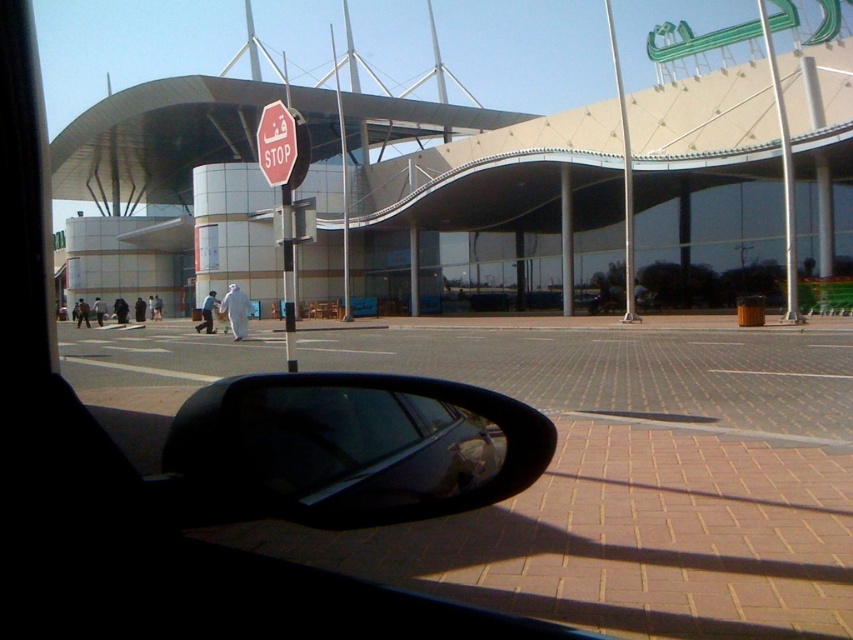
Does point (714, 208) lie in front of point (273, 116)?

No, it is behind (273, 116).

Who is more forward, (532,268) or (265,122)?

Positioned in front is point (265,122).

Find the location of a particular element. The width and height of the screenshot is (853, 640). beige glass airport terminal at center is located at coordinates (338, 193).

Is point (477, 458) less distant than point (764, 33)?

Yes, point (477, 458) is closer to viewer.

The image size is (853, 640). Identify the location of black glossy side mirror at lower left. (346, 449).

Is metallic pole at center positioned before red matte stop sign at center?

No.

Who is more forward, (624, 97) or (259, 131)?

Point (259, 131) is more forward.

Identify the location of metallic pole at center. Image resolution: width=853 pixels, height=640 pixels. (624, 177).